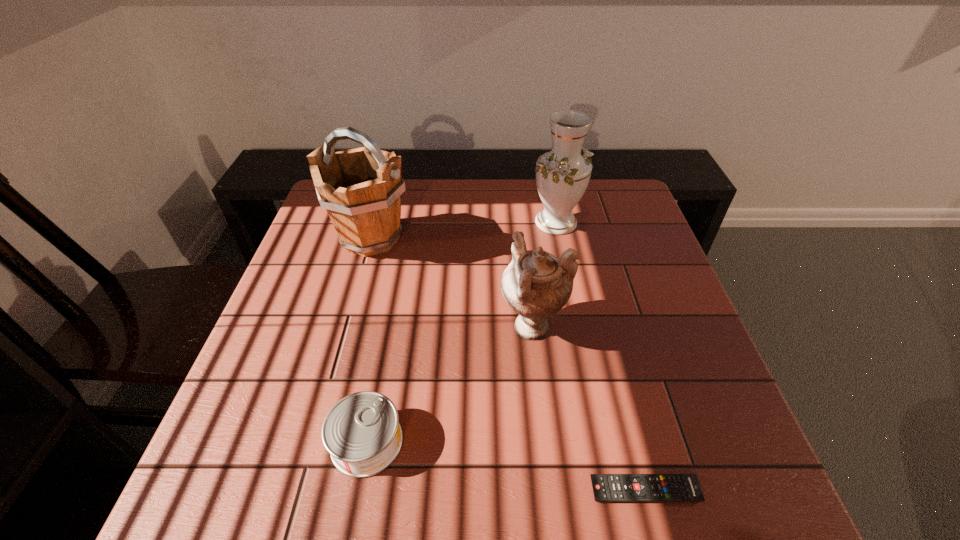
The image size is (960, 540). I want to click on vacant space at the near edge of the desktop, so click(x=443, y=494).

Where is `vacant area at the left edge`? The height and width of the screenshot is (540, 960). vacant area at the left edge is located at coordinates (314, 230).

The width and height of the screenshot is (960, 540). Find the location of `free location at the right edge of the desktop`. free location at the right edge of the desktop is located at coordinates (675, 421).

Locate an element on the screen. vacant space at the near right corner of the desktop is located at coordinates (765, 500).

Where is `vacant space that's between the can and the bucket`? The height and width of the screenshot is (540, 960). vacant space that's between the can and the bucket is located at coordinates (369, 340).

You are a GUI agent. You are given a task and a screenshot of the screen. Output one action in this format:
    pyautogui.click(x=<x>, y=<y>)
    Task: Click on the free spot between the bucket and the third shortest object
    
    Given the screenshot: What is the action you would take?
    pyautogui.click(x=452, y=282)

This screenshot has width=960, height=540. In order to click on empty space between the vase and the bucket in this screenshot , I will do (464, 230).

This screenshot has height=540, width=960. Identify the location of empty location between the can and the bucket. (369, 340).

The image size is (960, 540). Identify the location of free space between the second shortest object and the shortest object. (506, 466).

At what (x,y) coordinates should I click in order to perform the action: click on vacant region between the vase and the can. Please return your answer as a coordinate pair (x, y). This screenshot has height=540, width=960. Looking at the image, I should click on (462, 332).